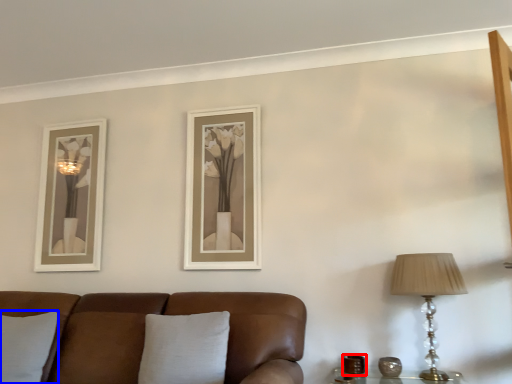
Question: Which object is closer to the camera taking this photo, candle holder (highlighted by a red box) or pillow (highlighted by a blue box)?

Choices:
 (A) candle holder
 (B) pillow

Answer: (B)